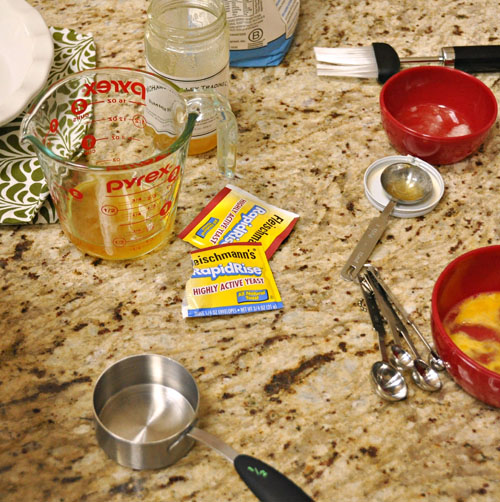
Locate an element on the screen. bowls is located at coordinates (432, 124), (475, 319).